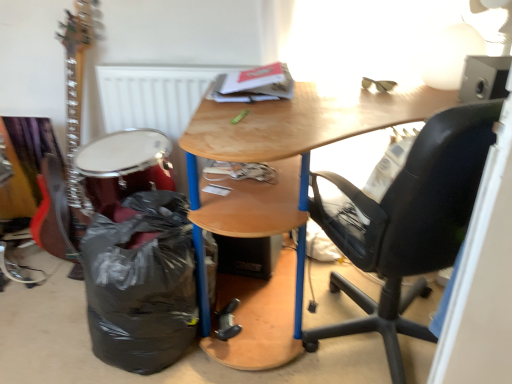
Question: Considering the relative sizes of black leather office chair at right and white matte radiator at upper center in the image provided, is black leather office chair at right thinner than white matte radiator at upper center?

Choices:
 (A) yes
 (B) no

Answer: (B)

Question: Does black leather office chair at right have a smaller size compared to white matte radiator at upper center?

Choices:
 (A) no
 (B) yes

Answer: (A)

Question: Is black leather office chair at right beside white matte radiator at upper center?

Choices:
 (A) no
 (B) yes

Answer: (A)

Question: From the image's perspective, is black leather office chair at right on white matte radiator at upper center?

Choices:
 (A) yes
 (B) no

Answer: (B)

Question: Can we say black leather office chair at right lies outside white matte radiator at upper center?

Choices:
 (A) no
 (B) yes

Answer: (B)

Question: Relative to shiny red drum at lower left, is white matte radiator at upper center in front or behind?

Choices:
 (A) front
 (B) behind

Answer: (B)

Question: From a real-world perspective, is white matte radiator at upper center above or below shiny red drum at lower left?

Choices:
 (A) above
 (B) below

Answer: (A)

Question: Considering the positions of point (181, 107) and point (96, 145), is point (181, 107) closer or farther from the camera than point (96, 145)?

Choices:
 (A) farther
 (B) closer

Answer: (A)

Question: From the image's perspective, is white matte radiator at upper center positioned above or below shiny red drum at lower left?

Choices:
 (A) below
 (B) above

Answer: (B)

Question: From their relative heights in the image, would you say black plastic bag at lower left is taller or shorter than wooden desk at center?

Choices:
 (A) tall
 (B) short

Answer: (B)

Question: Is black plastic bag at lower left bigger or smaller than wooden desk at center?

Choices:
 (A) small
 (B) big

Answer: (A)

Question: Visually, is black plastic bag at lower left positioned to the left or to the right of wooden desk at center?

Choices:
 (A) left
 (B) right

Answer: (A)

Question: Relative to wooden desk at center, is black plastic bag at lower left in front or behind?

Choices:
 (A) front
 (B) behind

Answer: (B)

Question: In terms of height, does black plastic bag at lower left look taller or shorter compared to shiny red drum at lower left?

Choices:
 (A) tall
 (B) short

Answer: (A)

Question: Would you say black plastic bag at lower left is inside or outside shiny red drum at lower left?

Choices:
 (A) outside
 (B) inside

Answer: (A)